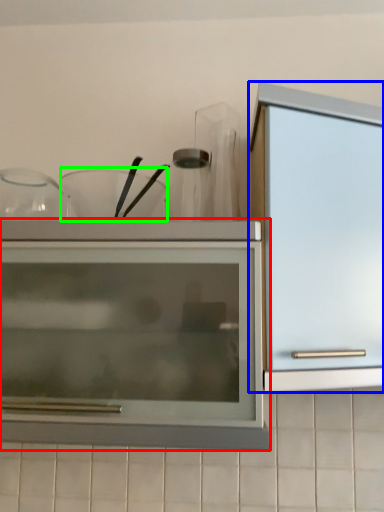
Question: Which is nearer to the cupboard (highlighted by a red box)? cabinetry (highlighted by a blue box) or tableware (highlighted by a green box).

Choices:
 (A) cabinetry
 (B) tableware

Answer: (A)